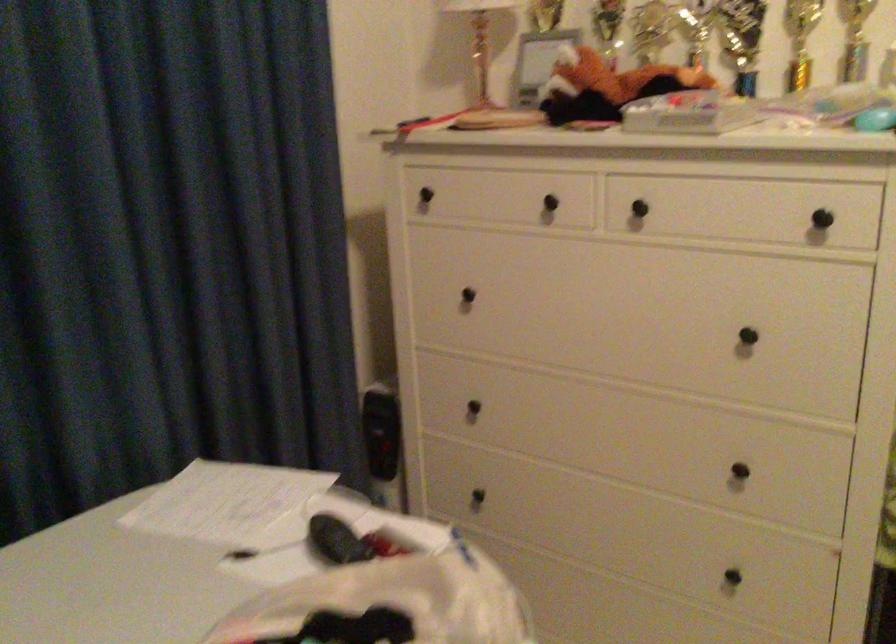
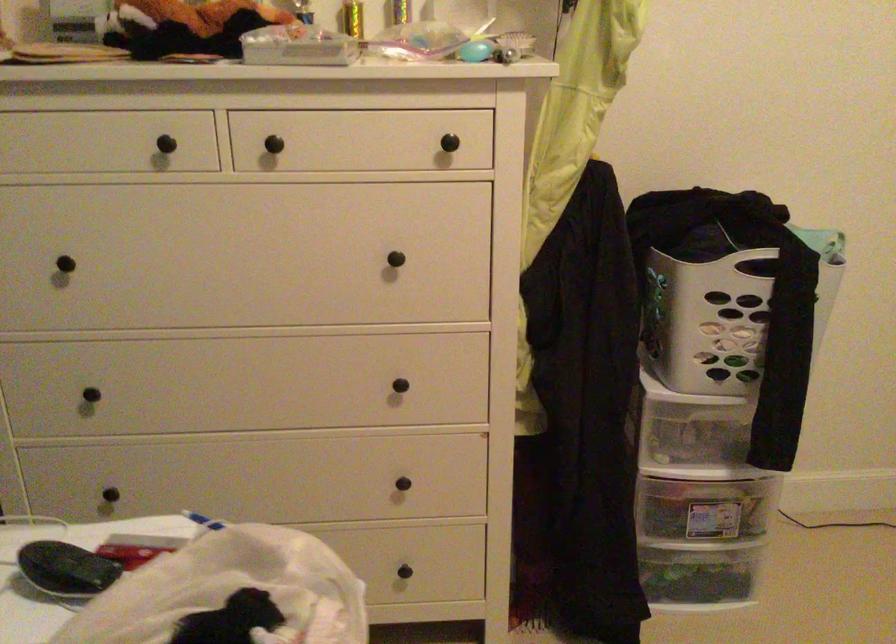
Question: How did the camera likely rotate?

Choices:
 (A) Left
 (B) Right
 (C) Up
 (D) Down

Answer: (B)